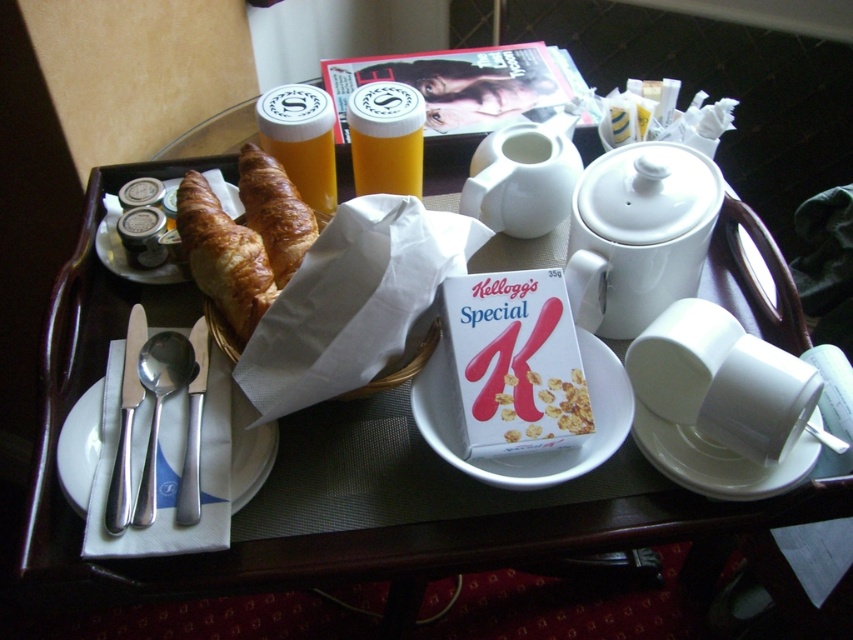
Question: Is golden brown croissant at left wider than white glossy plate at center?

Choices:
 (A) no
 (B) yes

Answer: (A)

Question: Does yellow plastic cup at center have a smaller size compared to satin silver knife and spoon at lower left?

Choices:
 (A) yes
 (B) no

Answer: (A)

Question: Which point is farther to the camera?

Choices:
 (A) (554, 392)
 (B) (614, 252)
 (C) (242, 193)

Answer: (C)

Question: Which is farther from the golden brown flaky croissant at center?

Choices:
 (A) white glossy bowl at center
 (B) white porcelain plate at center

Answer: (A)

Question: Which of the following is the closest to the observer?

Choices:
 (A) (148, 371)
 (B) (695, 465)
 (C) (225, 248)

Answer: (B)

Question: Is white ceramic teapot at center thinner than golden brown flaky croissant at center?

Choices:
 (A) yes
 (B) no

Answer: (B)